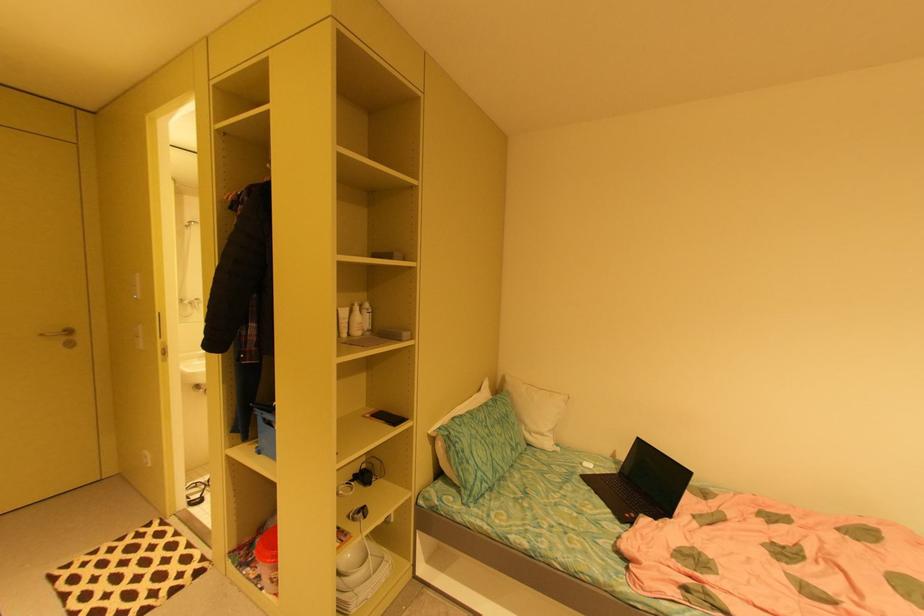
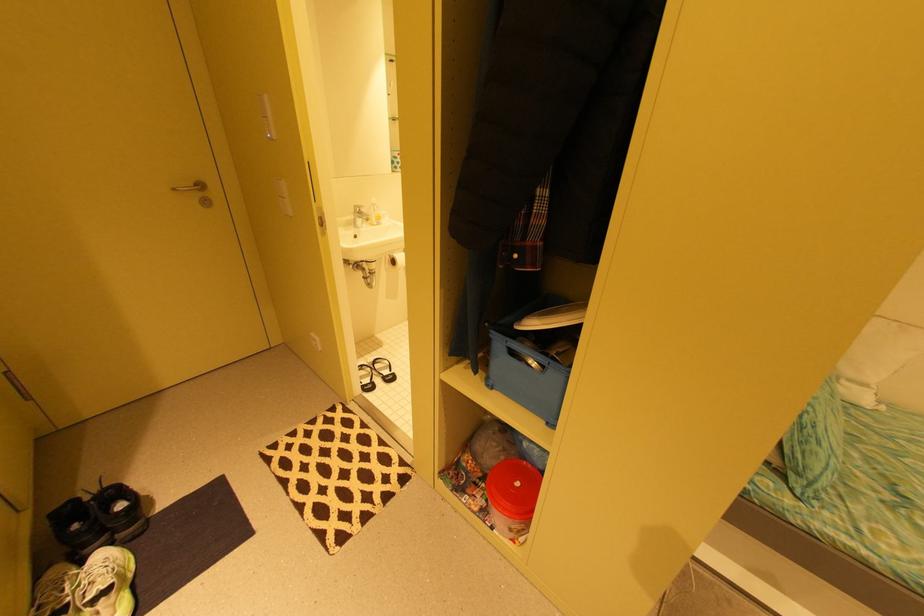
In a continuous first-person perspective shot, in which direction is the camera moving?

The cameraman walked toward left, forward.